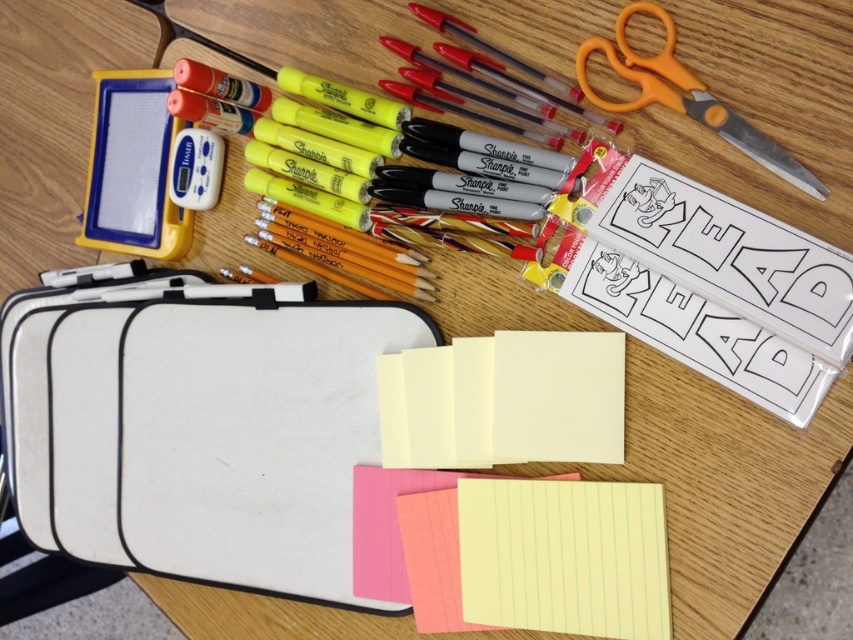
Who is taller, orange plastic scissors at upper right or lined paper at center?

orange plastic scissors at upper right

Between orange plastic scissors at upper right and lined paper at center, which one is positioned lower?

lined paper at center

Where is `orange plastic scissors at upper right`? The width and height of the screenshot is (853, 640). orange plastic scissors at upper right is located at coordinates (685, 97).

Does yellow paper notepad at center have a lesser width compared to orange plastic scissors at upper right?

No, yellow paper notepad at center is not thinner than orange plastic scissors at upper right.

Is yellow paper notepad at center bigger than orange plastic scissors at upper right?

Actually, yellow paper notepad at center might be smaller than orange plastic scissors at upper right.

What do you see at coordinates (503, 401) in the screenshot? I see `yellow paper notepad at center` at bounding box center [503, 401].

You are a GUI agent. You are given a task and a screenshot of the screen. Output one action in this format:
    pyautogui.click(x=<x>, y=<y>)
    Task: Click on the yellow paper notepad at center
    Image resolution: width=853 pixels, height=640 pixels.
    Given the screenshot: What is the action you would take?
    pyautogui.click(x=503, y=401)

Is yellow paper notepad at center to the left of lined paper at center from the viewer's perspective?

No, yellow paper notepad at center is not to the left of lined paper at center.

Between point (503, 417) and point (368, 516), which one is positioned behind?

Point (368, 516)

Locate an element on the screen. The width and height of the screenshot is (853, 640). yellow paper notepad at center is located at coordinates [x=503, y=401].

Where is `yellow paper notepad at center`? yellow paper notepad at center is located at coordinates (503, 401).